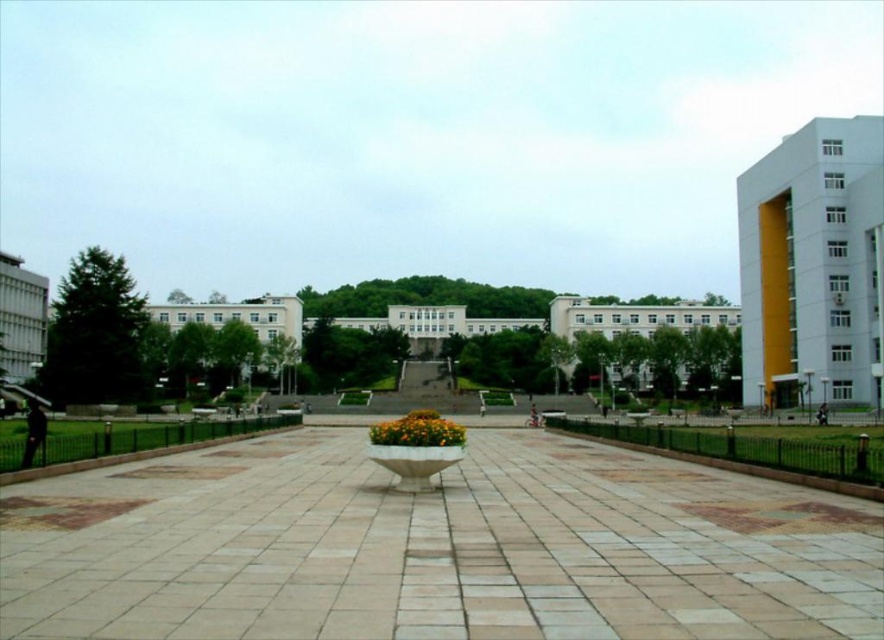
Identify the location of white stone path at center. The image size is (884, 640). (433, 547).

Is white stone path at center wider than yellow matte flower at center?

Yes.

Which is in front, point (21, 609) or point (433, 428)?

Positioned in front is point (21, 609).

Where is `white stone path at center`? This screenshot has width=884, height=640. white stone path at center is located at coordinates (433, 547).